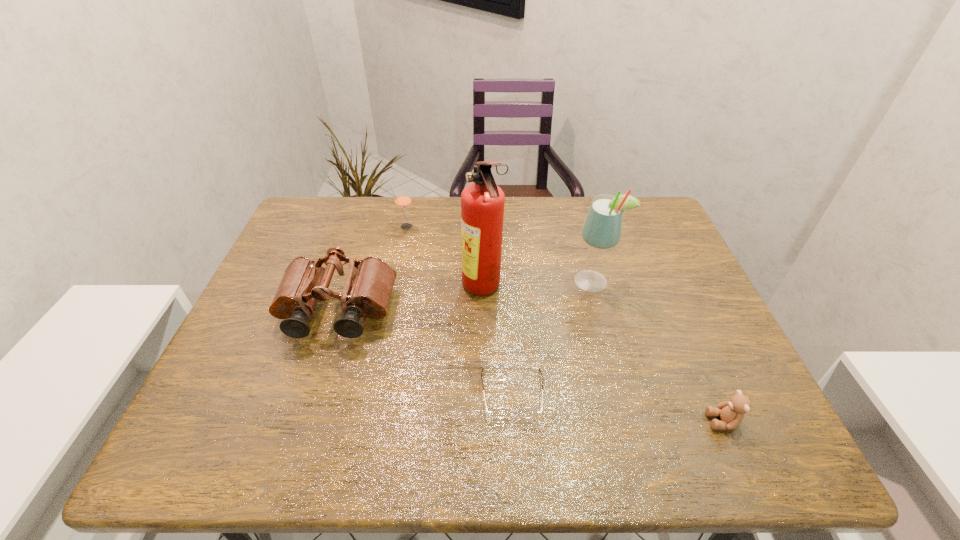
Where is `the tallest object`? The width and height of the screenshot is (960, 540). the tallest object is located at coordinates (482, 203).

Find the location of a particular element. The image size is (960, 540). the second tallest object is located at coordinates (602, 229).

I want to click on the second object from right to left, so 602,229.

I want to click on straw, so click(403, 201).

What are the coordinates of `binoculars` in the screenshot? It's located at (367, 292).

Locate an element on the screen. The height and width of the screenshot is (540, 960). the rightmost object is located at coordinates (731, 412).

This screenshot has height=540, width=960. I want to click on teddy bear, so click(731, 412).

Locate an element on the screen. This screenshot has width=960, height=540. spectacles is located at coordinates (501, 412).

Locate an element on the screen. vacant space located on the front-facing side of the tallest object is located at coordinates (333, 289).

The image size is (960, 540). I want to click on vacant region located on the front-facing side of the tallest object, so (405, 289).